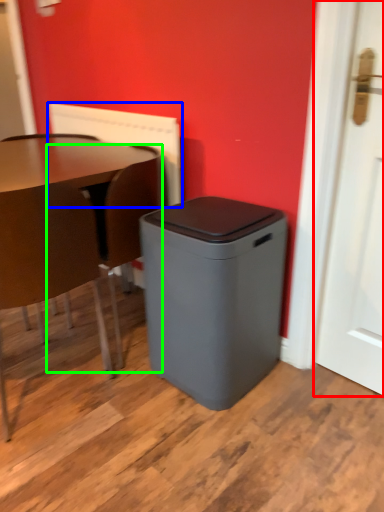
Question: Which is farther away from door (highlighted by a red box)? radiator (highlighted by a blue box) or swivel chair (highlighted by a green box)?

Choices:
 (A) radiator
 (B) swivel chair

Answer: (A)